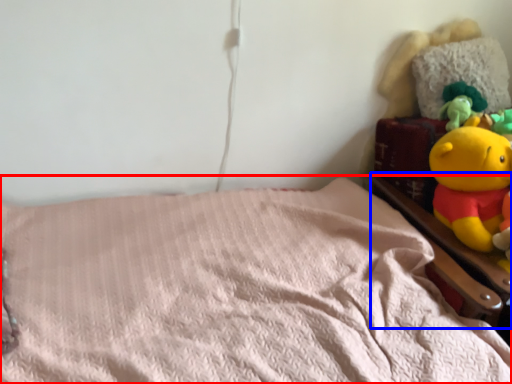
Question: Which of the following is the closest to the observer, bed (highlighted by a red box) or bed frame (highlighted by a blue box)?

Choices:
 (A) bed
 (B) bed frame

Answer: (A)